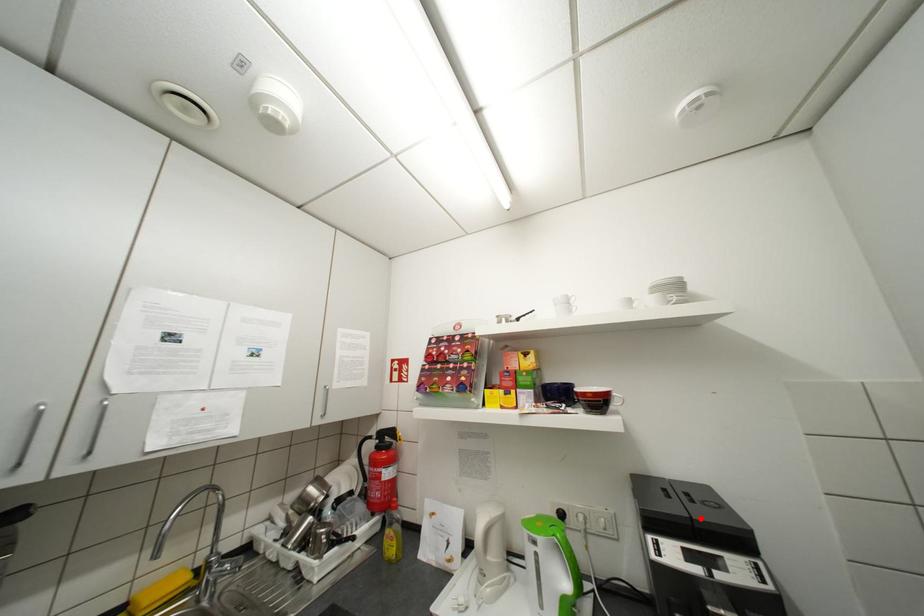
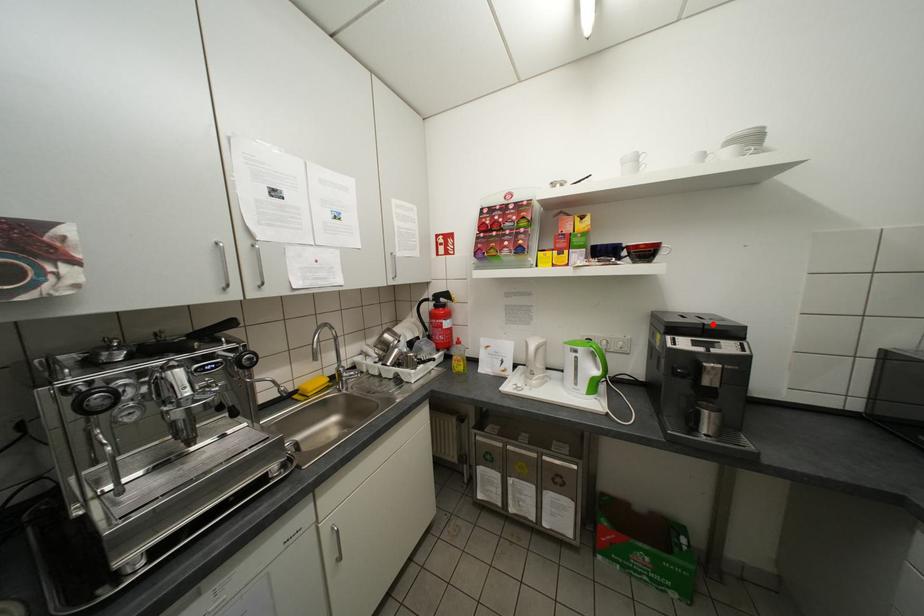
I am providing you with two images of the same scene from different viewpoints. A red point is marked on the first image and another point is marked on the second image. Does the point marked in image1 correspond to the same location as the one in image2?

Yes